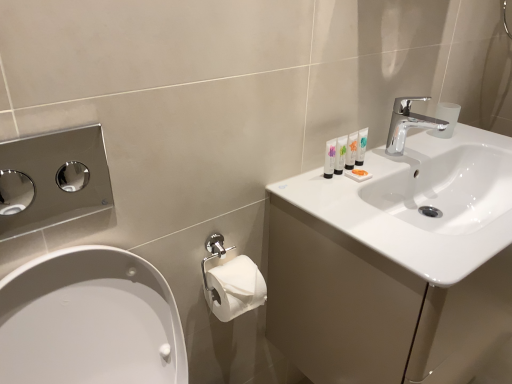
Question: Considering the relative positions of translucent plastic tubes at upper right, the second mouthwash from the left, and white glossy tubes at upper right, which ranks as the 4th mouthwash in right-to-left order, in the image provided, is translucent plastic tubes at upper right, the second mouthwash from the left, to the left of white glossy tubes at upper right, which ranks as the 4th mouthwash in right-to-left order, from the viewer's perspective?

Choices:
 (A) no
 (B) yes

Answer: (A)

Question: Does translucent plastic tubes at upper right, the second mouthwash from the left, have a greater width compared to white glossy tubes at upper right, which ranks as the 4th mouthwash in right-to-left order?

Choices:
 (A) yes
 (B) no

Answer: (A)

Question: Is translucent plastic tubes at upper right, the third mouthwash from the right, thinner than white glossy tubes at upper right, the first mouthwash when ordered from left to right?

Choices:
 (A) yes
 (B) no

Answer: (B)

Question: Considering the relative sizes of translucent plastic tubes at upper right, the third mouthwash from the right, and white glossy tubes at upper right, the first mouthwash when ordered from left to right, in the image provided, is translucent plastic tubes at upper right, the third mouthwash from the right, shorter than white glossy tubes at upper right, the first mouthwash when ordered from left to right,?

Choices:
 (A) no
 (B) yes

Answer: (A)

Question: From the image's perspective, is translucent plastic tubes at upper right, the third mouthwash from the right, below white glossy tubes at upper right, which ranks as the 4th mouthwash in right-to-left order?

Choices:
 (A) yes
 (B) no

Answer: (B)

Question: From a real-world perspective, is translucent plastic tubes at upper right, the second mouthwash from the left, physically below white glossy tubes at upper right, which ranks as the 4th mouthwash in right-to-left order?

Choices:
 (A) no
 (B) yes

Answer: (A)

Question: Is polished chrome hand dryer at left shorter than white glossy sink at upper right?

Choices:
 (A) yes
 (B) no

Answer: (B)

Question: Is polished chrome hand dryer at left facing towards white glossy sink at upper right?

Choices:
 (A) no
 (B) yes

Answer: (A)

Question: Is polished chrome hand dryer at left further to the viewer compared to white glossy sink at upper right?

Choices:
 (A) no
 (B) yes

Answer: (A)

Question: From a real-world perspective, is polished chrome hand dryer at left on white glossy sink at upper right?

Choices:
 (A) no
 (B) yes

Answer: (B)

Question: Is polished chrome hand dryer at left beside white glossy sink at upper right?

Choices:
 (A) yes
 (B) no

Answer: (B)

Question: Considering the relative sizes of polished chrome hand dryer at left and white glossy sink at upper right in the image provided, is polished chrome hand dryer at left taller than white glossy sink at upper right?

Choices:
 (A) yes
 (B) no

Answer: (A)

Question: Is white glossy sink at upper right directly adjacent to polished chrome hand dryer at left?

Choices:
 (A) no
 (B) yes

Answer: (A)